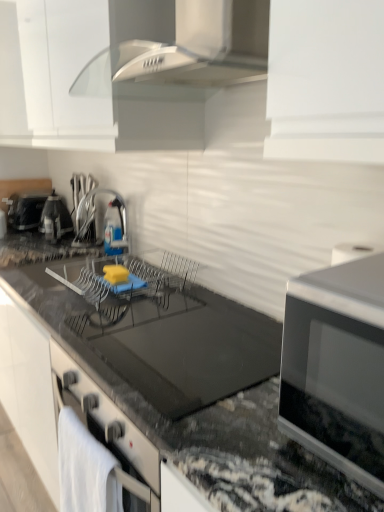
The image size is (384, 512). What do you see at coordinates (26, 209) in the screenshot? I see `black plastic toaster at left, which appears as the first appliance when viewed from the back` at bounding box center [26, 209].

What do you see at coordinates (103, 222) in the screenshot? This screenshot has width=384, height=512. I see `satin nickel faucet at center, acting as the first appliance starting from the right` at bounding box center [103, 222].

This screenshot has height=512, width=384. Describe the element at coordinates (161, 390) in the screenshot. I see `black glass countertop at center` at that location.

At what (x,y) coordinates should I click in order to perform the action: click on black plastic toaster at left, positioned as the first appliance in left-to-right order. Please return your answer as a coordinate pair (x, y). The width and height of the screenshot is (384, 512). Looking at the image, I should click on (26, 209).

Would you say transparent plastic bottle at center contains silver metallic microwave at right?

No.

Between transparent plastic bottle at center and silver metallic microwave at right, which one appears on the left side from the viewer's perspective?

Positioned to the left is transparent plastic bottle at center.

Is point (112, 202) farther from viewer compared to point (333, 287)?

Yes, it is.

Between black glass countertop at center and white matte cabinetry at upper center, which one has larger size?

white matte cabinetry at upper center is bigger.

Is black glass countertop at center facing towards white matte cabinetry at upper center?

No, black glass countertop at center is not turned towards white matte cabinetry at upper center.

At what (x,y) coordinates should I click in order to perform the action: click on cabinetry in front of the black glass countertop at center. Please return your answer as a coordinate pair (x, y). The image size is (384, 512). Looking at the image, I should click on (71, 86).

Is black glass countertop at center directly adjacent to white matte cabinetry at upper center?

No, black glass countertop at center is not with white matte cabinetry at upper center.

From a real-world perspective, does transparent plastic bottle at center stand above metallic silver kettle at left, the second appliance in the right-to-left sequence?

No.

Which object is wider, transparent plastic bottle at center or metallic silver kettle at left, the 2th appliance when ordered from back to front?

metallic silver kettle at left, the 2th appliance when ordered from back to front.

From the image's perspective, is transparent plastic bottle at center beneath metallic silver kettle at left, the second appliance in the right-to-left sequence?

Yes.

At what (x,y) coordinates should I click in order to perform the action: click on bottle lying below the metallic silver kettle at left, the second appliance in the right-to-left sequence (from the image's perspective). Please return your answer as a coordinate pair (x, y). This screenshot has width=384, height=512. Looking at the image, I should click on (113, 227).

Looking at their sizes, would you say metallic silver kettle at left, the 2th appliance when ordered from back to front, is wider or thinner than white matte cabinetry at upper center?

Considering their sizes, metallic silver kettle at left, the 2th appliance when ordered from back to front, looks slimmer than white matte cabinetry at upper center.

How many degrees apart are the facing directions of metallic silver kettle at left, which ranks as the second appliance in front-to-back order, and white matte cabinetry at upper center?

They differ by 0.00226 degrees in their facing directions.

Is metallic silver kettle at left, the 2th appliance viewed from the left, facing towards white matte cabinetry at upper center?

No, metallic silver kettle at left, the 2th appliance viewed from the left, is not aimed at white matte cabinetry at upper center.

Is metallic silver kettle at left, the second appliance in the right-to-left sequence, far from white matte cabinetry at upper center?

metallic silver kettle at left, the second appliance in the right-to-left sequence, is near white matte cabinetry at upper center, not far away.

Between silver metallic microwave at right and black plastic toaster at left, positioned as the first appliance in left-to-right order, which one has larger size?

Bigger between the two is silver metallic microwave at right.

From their relative heights in the image, would you say silver metallic microwave at right is taller or shorter than black plastic toaster at left, which appears as the third appliance when viewed from the front?

Considering their sizes, silver metallic microwave at right has more height than black plastic toaster at left, which appears as the third appliance when viewed from the front.

Considering the relative positions of silver metallic microwave at right and black plastic toaster at left, positioned as the first appliance in left-to-right order, in the image provided, is silver metallic microwave at right to the right of black plastic toaster at left, positioned as the first appliance in left-to-right order, from the viewer's perspective?

Correct, you'll find silver metallic microwave at right to the right of black plastic toaster at left, positioned as the first appliance in left-to-right order.

Can you tell me how much satin nickel faucet at center, placed as the 3th appliance when sorted from left to right, and white towel at lower left differ in facing direction?

0.983 degrees.

Who is more distant, satin nickel faucet at center, acting as the first appliance starting from the right, or white towel at lower left?

satin nickel faucet at center, acting as the first appliance starting from the right, is behind.

Is satin nickel faucet at center, placed as the 3th appliance when sorted from left to right, bigger or smaller than white towel at lower left?

Clearly, satin nickel faucet at center, placed as the 3th appliance when sorted from left to right, is smaller in size than white towel at lower left.

From the white towel at lower left, count 1st appliances backward and point to it. Please provide its 2D coordinates.

[(103, 222)]

From the image's perspective, which is below, metallic silver kettle at left, which ranks as the second appliance in front-to-back order, or silver metallic microwave at right?

From the image's view, silver metallic microwave at right is below.

Is metallic silver kettle at left, the second appliance in the right-to-left sequence, inside or outside of silver metallic microwave at right?

The correct answer is: outside.

Can you confirm if metallic silver kettle at left, the 2th appliance when ordered from back to front, is wider than silver metallic microwave at right?

Incorrect, the width of metallic silver kettle at left, the 2th appliance when ordered from back to front, does not surpass that of silver metallic microwave at right.

Can you confirm if metallic silver kettle at left, the 2th appliance viewed from the left, is smaller than silver metallic microwave at right?

Indeed, metallic silver kettle at left, the 2th appliance viewed from the left, has a smaller size compared to silver metallic microwave at right.

I want to click on kitchen appliance below the transparent plastic bottle at center (from the image's perspective), so click(x=337, y=367).

I want to click on cabinetry in front of the black glass countertop at center, so click(71, 86).

Looking at the image, which one is located closer to black glass countertop at center, white matte cabinetry at upper center or transparent plastic bottle at center?

white matte cabinetry at upper center is closer to black glass countertop at center.

Estimate the real-world distances between objects in this image. Which object is closer to transparent plastic bottle at center, silver metallic microwave at right or black glass countertop at center?

black glass countertop at center is positioned closer to the anchor transparent plastic bottle at center.

Looking at the image, which one is located further to white towel at lower left, metallic silver kettle at left, which ranks as the second appliance in front-to-back order, or black glass countertop at center?

The object further to white towel at lower left is metallic silver kettle at left, which ranks as the second appliance in front-to-back order.

Based on their spatial positions, is white towel at lower left or metallic silver kettle at left, the 2th appliance viewed from the left, closer to black plastic toaster at left, marked as the 3th appliance in a right-to-left arrangement?

Based on the image, metallic silver kettle at left, the 2th appliance viewed from the left, appears to be nearer to black plastic toaster at left, marked as the 3th appliance in a right-to-left arrangement.

From the image, which object appears to be farther from satin nickel faucet at center, placed as the 3th appliance when sorted from left to right, silver metallic microwave at right or transparent plastic bottle at center?

silver metallic microwave at right lies further to satin nickel faucet at center, placed as the 3th appliance when sorted from left to right, than the other object.

Which object lies further to the anchor point transparent plastic bottle at center, white matte cabinetry at upper center or metallic silver kettle at left, the 2th appliance when ordered from back to front?

white matte cabinetry at upper center is positioned further to the anchor transparent plastic bottle at center.

From the image, which object appears to be nearer to black glass countertop at center, satin nickel faucet at center, acting as the first appliance starting from the right, or white towel at lower left?

Among the two, white towel at lower left is located nearer to black glass countertop at center.

When comparing their distances from white towel at lower left, does satin nickel faucet at center, acting as the first appliance starting from the right, or black plastic toaster at left, positioned as the first appliance in left-to-right order, seem closer?

The object closer to white towel at lower left is satin nickel faucet at center, acting as the first appliance starting from the right.

Where is `material between white matte cabinetry at upper center and transparent plastic bottle at center in the front-back direction`? The image size is (384, 512). material between white matte cabinetry at upper center and transparent plastic bottle at center in the front-back direction is located at coordinates (85, 469).

Find the location of a particular element. The height and width of the screenshot is (512, 384). kitchen appliance between white matte cabinetry at upper center and satin nickel faucet at center, which ranks as the 1th appliance in front-to-back order, in the front-back direction is located at coordinates (337, 367).

Find the location of a particular element. The height and width of the screenshot is (512, 384). material positioned between black glass countertop at center and metallic silver kettle at left, the second appliance in the right-to-left sequence, from near to far is located at coordinates [85, 469].

At what (x,y) coordinates should I click in order to perform the action: click on bottle located between satin nickel faucet at center, acting as the first appliance starting from the right, and metallic silver kettle at left, which ranks as the second appliance in front-to-back order, in the depth direction. Please return your answer as a coordinate pair (x, y). Looking at the image, I should click on (113, 227).